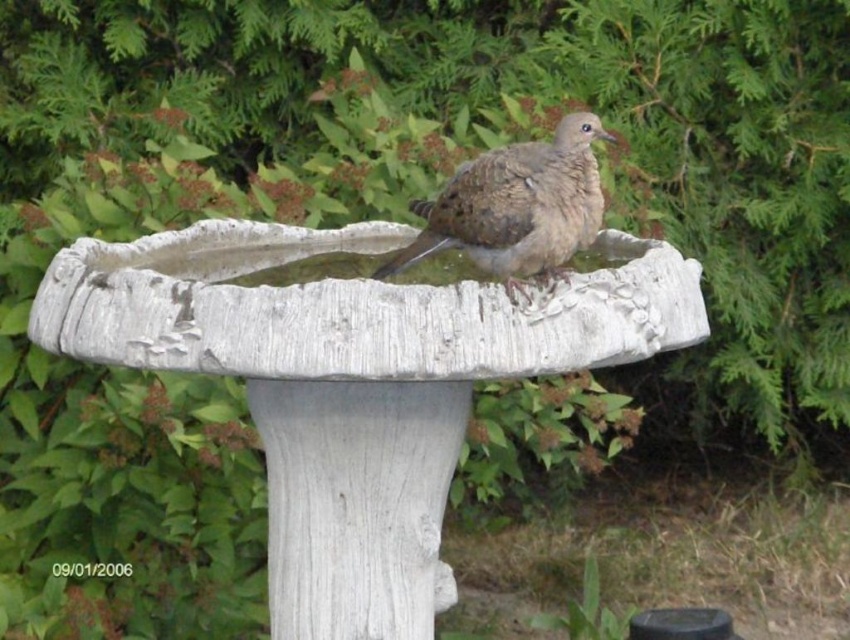
Who is taller, white concrete bird bath at center or brown speckled bird at center?

With more height is white concrete bird bath at center.

Which is behind, point (541, 346) or point (590, 134)?

Positioned behind is point (590, 134).

Which is in front, point (190, 328) or point (446, 240)?

Point (190, 328) is in front.

This screenshot has height=640, width=850. I want to click on white concrete bird bath at center, so click(354, 384).